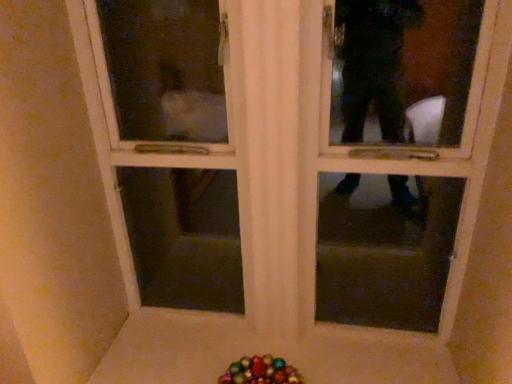
I want to click on vacant point above multicolored glass beads at lower center (from a real-world perspective), so click(x=253, y=372).